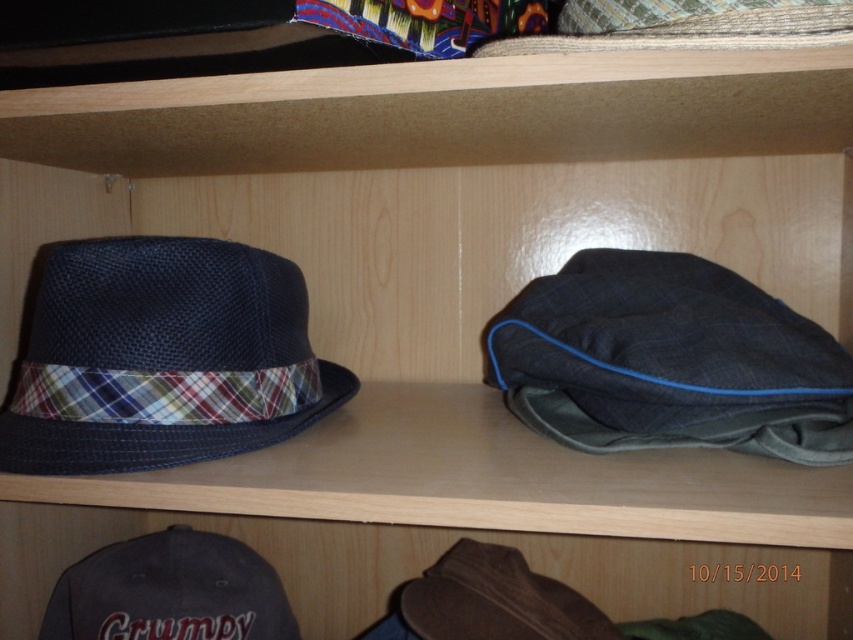
You are organizing a hat display and need to stack the dark blue woven hat at left and the dark gray fabric cap at lower left vertically. Which one should you place at the bottom to ensure stability?

The dark blue woven hat at left is taller than the dark gray fabric cap at lower left, so placing the taller hat at the bottom would provide a more stable base for the stack.

You are organizing a hat collection and need to place the dark blue woven hat at left and the dark gray fabric cap at lower left onto a shelf. Based on their current positions, which hat should you move first to maintain the left to right order?

The dark blue woven hat at left is positioned on the left side of the dark gray fabric cap at lower left, so you should move the dark gray fabric cap at lower left first to maintain the left to right order.